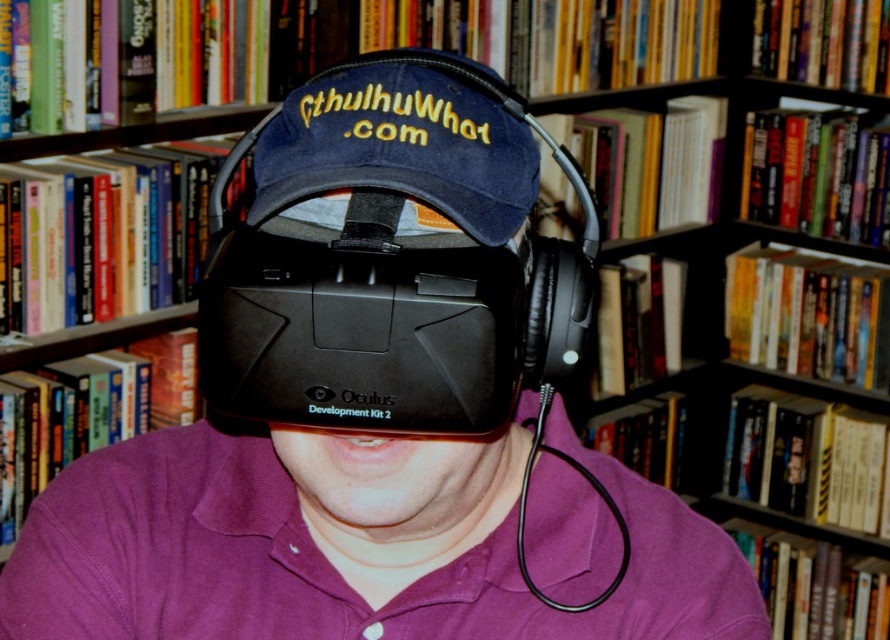
Between black matte vr headset at center and denim baseball cap at center, which one has less height?

denim baseball cap at center is shorter.

Which is in front, point (587, 248) or point (368, 176)?

Point (368, 176)

Does point (264, 298) lie behind point (289, 150)?

No, (264, 298) is closer to viewer.

Locate an element on the screen. black matte vr headset at center is located at coordinates (392, 260).